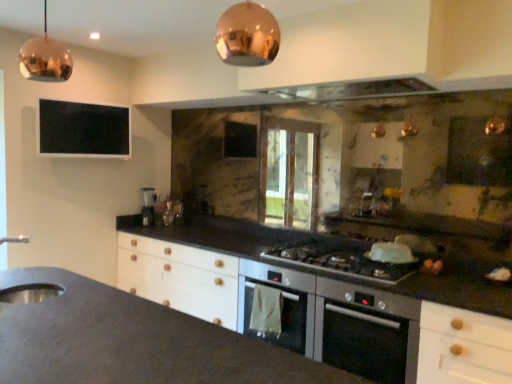
Find the location of a particular element. This screenshot has height=384, width=512. vacant space underneath stainless steel sink at lower left (from a real-world perspective) is located at coordinates (16, 292).